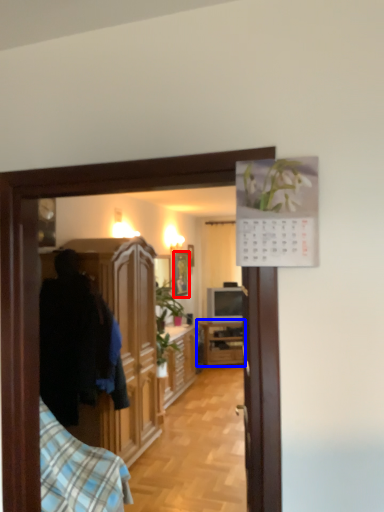
Question: Among these objects, which one is farthest to the camera, picture frame (highlighted by a red box) or cabinetry (highlighted by a blue box)?

Choices:
 (A) picture frame
 (B) cabinetry

Answer: (B)